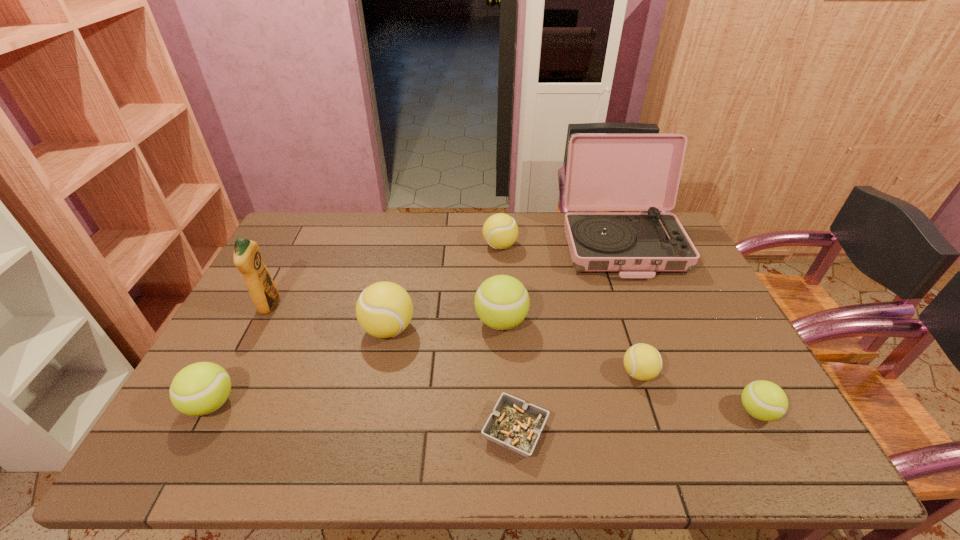
In order to click on tennis ball at the left edge in this screenshot , I will do `click(201, 388)`.

You are a GUI agent. You are given a task and a screenshot of the screen. Output one action in this format:
    pyautogui.click(x=<x>, y=<y>)
    Task: Click on the record player that is positioned at the right edge
    This screenshot has width=960, height=540.
    Given the screenshot: What is the action you would take?
    pyautogui.click(x=605, y=171)

Identify the location of tennis ball situated at the right edge. (764, 400).

This screenshot has height=540, width=960. What are the coordinates of `object that is at the far right corner` in the screenshot? It's located at (605, 171).

Where is `object that is at the near right corner`? The width and height of the screenshot is (960, 540). object that is at the near right corner is located at coordinates pos(764,400).

Where is `free region at the far edge`? The width and height of the screenshot is (960, 540). free region at the far edge is located at coordinates (338, 227).

Identify the location of vacant space at the left edge of the desktop. The width and height of the screenshot is (960, 540). (269, 259).

The height and width of the screenshot is (540, 960). In order to click on free space at the right edge of the desktop in this screenshot , I will do `click(679, 339)`.

I want to click on blank space at the far left corner of the desktop, so pyautogui.click(x=316, y=228).

Find the location of a particular element. free region at the near right corner is located at coordinates (789, 453).